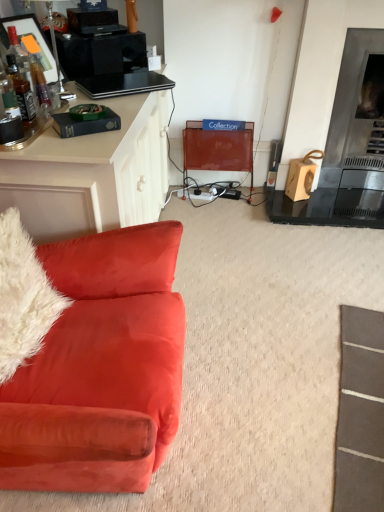
The image size is (384, 512). What do you see at coordinates (354, 138) in the screenshot?
I see `metallic silver fireplace at right` at bounding box center [354, 138].

What is the approximate height of metallic mesh swivel chair at center?

20.50 inches.

The image size is (384, 512). Describe the element at coordinates (23, 296) in the screenshot. I see `white fluffy pillow at left` at that location.

The image size is (384, 512). I want to click on velvet orange couch at left, so click(x=90, y=360).

Can you tell me how much white fluffy pillow at left and metallic mesh swivel chair at center differ in facing direction?

They differ by 79.6 degrees in their facing directions.

From a real-world perspective, which is physically below, white fluffy pillow at left or metallic mesh swivel chair at center?

metallic mesh swivel chair at center.

Can you confirm if white fluffy pillow at left is taller than metallic mesh swivel chair at center?

No, white fluffy pillow at left is not taller than metallic mesh swivel chair at center.

From the image's perspective, who appears lower, white fluffy pillow at left or metallic mesh swivel chair at center?

white fluffy pillow at left appears lower in the image.

Considering the relative positions of metallic mesh swivel chair at center and velvet orange couch at left in the image provided, is metallic mesh swivel chair at center to the left of velvet orange couch at left from the viewer's perspective?

In fact, metallic mesh swivel chair at center is to the right of velvet orange couch at left.

How many degrees apart are the facing directions of metallic mesh swivel chair at center and velvet orange couch at left?

metallic mesh swivel chair at center and velvet orange couch at left are facing 90 degrees away from each other.

In terms of width, does metallic mesh swivel chair at center look wider or thinner when compared to velvet orange couch at left?

Clearly, metallic mesh swivel chair at center has less width compared to velvet orange couch at left.

Is velvet orange couch at left a part of metallic mesh swivel chair at center?

Definitely not — velvet orange couch at left is not inside metallic mesh swivel chair at center.

Between metallic mesh swivel chair at center and metallic silver fireplace at right, which one has larger width?

Wider between the two is metallic mesh swivel chair at center.

Which point is more forward, (207, 156) or (340, 125)?

The point (340, 125) is in front.

Locate an element on the screen. Image resolution: width=384 pixels, height=512 pixels. swivel chair to the left of metallic silver fireplace at right is located at coordinates (218, 150).

Is metallic mesh swivel chair at center not close to metallic silver fireplace at right?

No.

This screenshot has height=512, width=384. Find the location of `studio couch in front of the metallic silver fireplace at right`. studio couch in front of the metallic silver fireplace at right is located at coordinates (90, 360).

Are velvet orange couch at left and metallic silver fireplace at right beside each other?

No.

Does velvet orange couch at left turn towards metallic silver fireplace at right?

No, velvet orange couch at left is not turned towards metallic silver fireplace at right.

Is velvet orange couch at left closer to camera compared to white fluffy pillow at left?

Yes, velvet orange couch at left is closer to the viewer.

From the image's perspective, is velvet orange couch at left under white fluffy pillow at left?

Indeed, from the image's perspective, velvet orange couch at left is shown beneath white fluffy pillow at left.

Does velvet orange couch at left touch white fluffy pillow at left?

No.

Considering the sizes of objects white fluffy pillow at left and metallic silver fireplace at right in the image provided, who is shorter, white fluffy pillow at left or metallic silver fireplace at right?

With less height is white fluffy pillow at left.

Locate an element on the screen. fireplace lying on the right of white fluffy pillow at left is located at coordinates (354, 138).

From the image's perspective, is white fluffy pillow at left below metallic silver fireplace at right?

Yes, from the image's perspective, white fluffy pillow at left is below metallic silver fireplace at right.

From a real-world perspective, is white fluffy pillow at left located higher than metallic silver fireplace at right?

No.

Considering the positions of objects velvet orange couch at left and metallic mesh swivel chair at center in the image provided, who is more to the right, velvet orange couch at left or metallic mesh swivel chair at center?

From the viewer's perspective, metallic mesh swivel chair at center appears more on the right side.

Is velvet orange couch at left inside or outside of metallic mesh swivel chair at center?

The correct answer is: outside.

Which is behind, velvet orange couch at left or metallic mesh swivel chair at center?

Positioned behind is metallic mesh swivel chair at center.

Which object is wider, velvet orange couch at left or metallic mesh swivel chair at center?

With larger width is velvet orange couch at left.

Find the location of a particular element. This screenshot has width=384, height=512. swivel chair beneath the white fluffy pillow at left (from a real-world perspective) is located at coordinates (218, 150).

Find the location of a particular element. studio couch that appears above the metallic mesh swivel chair at center (from a real-world perspective) is located at coordinates (90, 360).

From the image, which object appears to be farther from metallic silver fireplace at right, metallic mesh swivel chair at center or velvet orange couch at left?

Among the two, velvet orange couch at left is located further to metallic silver fireplace at right.

Which object lies nearer to the anchor point velvet orange couch at left, metallic silver fireplace at right or metallic mesh swivel chair at center?

metallic mesh swivel chair at center.

From the image, which object appears to be farther from velvet orange couch at left, metallic mesh swivel chair at center or metallic silver fireplace at right?

Among the two, metallic silver fireplace at right is located further to velvet orange couch at left.

Looking at the image, which one is located further to metallic silver fireplace at right, white fluffy pillow at left or metallic mesh swivel chair at center?

Based on the image, white fluffy pillow at left appears to be further to metallic silver fireplace at right.

When comparing their distances from metallic mesh swivel chair at center, does white fluffy pillow at left or metallic silver fireplace at right seem further?

white fluffy pillow at left is positioned further to the anchor metallic mesh swivel chair at center.

Considering their positions, is velvet orange couch at left positioned closer to white fluffy pillow at left than metallic mesh swivel chair at center?

velvet orange couch at left.

When comparing their distances from metallic silver fireplace at right, does velvet orange couch at left or white fluffy pillow at left seem further?

white fluffy pillow at left is positioned further to the anchor metallic silver fireplace at right.

Considering their positions, is velvet orange couch at left positioned further to metallic mesh swivel chair at center than metallic silver fireplace at right?

velvet orange couch at left is positioned further to the anchor metallic mesh swivel chair at center.

Image resolution: width=384 pixels, height=512 pixels. Find the location of `fireplace between white fluffy pillow at left and metallic mesh swivel chair at center from front to back`. fireplace between white fluffy pillow at left and metallic mesh swivel chair at center from front to back is located at coordinates (354, 138).

Where is `pillow located between velvet orange couch at left and metallic silver fireplace at right in the depth direction`? This screenshot has width=384, height=512. pillow located between velvet orange couch at left and metallic silver fireplace at right in the depth direction is located at coordinates pos(23,296).

Image resolution: width=384 pixels, height=512 pixels. Identify the location of fireplace between velvet orange couch at left and metallic mesh swivel chair at center along the z-axis. (354, 138).

Where is `pillow between velvet orange couch at left and metallic mesh swivel chair at center from front to back`? The image size is (384, 512). pillow between velvet orange couch at left and metallic mesh swivel chair at center from front to back is located at coordinates (23, 296).